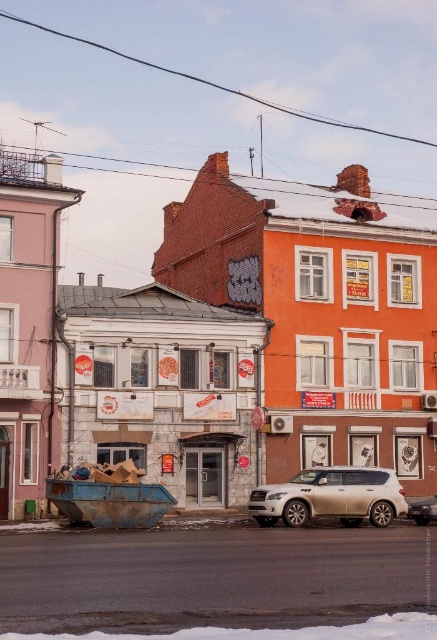
Question: Is rusty metal boat at lower left behind white powdery snow at lower center?

Choices:
 (A) yes
 (B) no

Answer: (A)

Question: Can you confirm if satin white suv at center is positioned below white powdery snow at lower center?

Choices:
 (A) no
 (B) yes

Answer: (B)

Question: Which point appears closest to the camera in this image?

Choices:
 (A) (118, 476)
 (B) (359, 502)

Answer: (A)

Question: Considering the relative positions of satin white suv at center and shiny silver suv at center in the image provided, where is satin white suv at center located with respect to shiny silver suv at center?

Choices:
 (A) left
 (B) right

Answer: (A)

Question: Which point appears closest to the camera in this image?

Choices:
 (A) (342, 481)
 (B) (128, 497)

Answer: (B)

Question: Which object is the closest to the rusty metal boat at lower left?

Choices:
 (A) shiny silver suv at center
 (B) white powdery snow at lower center

Answer: (A)